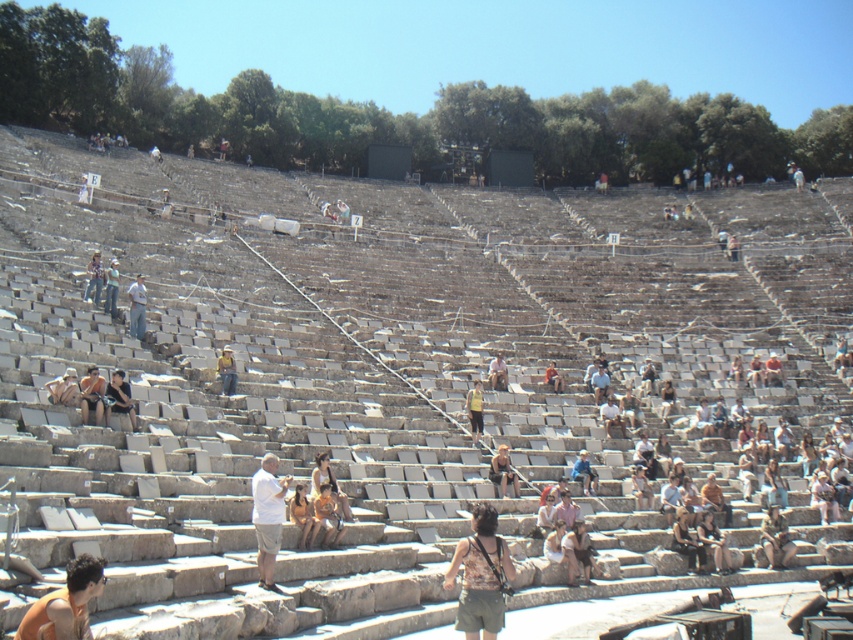
Question: Is brown leather bag at center closer to camera compared to white cotton shirt at upper right?

Choices:
 (A) yes
 (B) no

Answer: (A)

Question: Does light blue jeans at center appear on the right side of light brown wooden chair at center?

Choices:
 (A) yes
 (B) no

Answer: (B)

Question: Does matte black person at center appear on the left side of light blue jeans at center?

Choices:
 (A) no
 (B) yes

Answer: (A)

Question: Which of the following is the closest to the observer?

Choices:
 (A) denim shorts at center
 (B) brown fabric shirt at center

Answer: (B)

Question: Among these objects, which one is nearest to the camera?

Choices:
 (A) light brown fabric shorts at center
 (B) brown leather bag at center
 (C) brown fabric shirt at center

Answer: (C)

Question: Considering the real-world distances, which object is closest to the light brown wooden chair at center?

Choices:
 (A) dark brown leather jacket at center
 (B) brown fabric shirt at center
 (C) white cotton shirt at upper right
 (D) brown leather bag at center

Answer: (A)